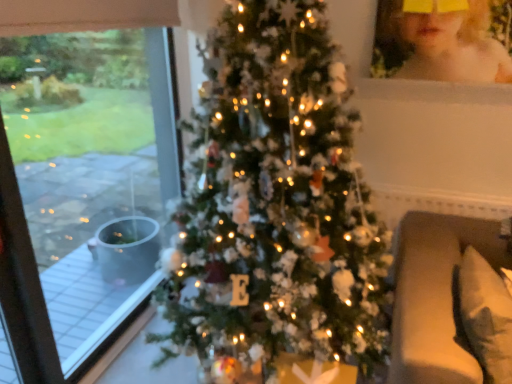
Question: Does transparent glass window at left have a lesser height compared to white soft pillow at lower right?

Choices:
 (A) no
 (B) yes

Answer: (A)

Question: Does transparent glass window at left turn towards white soft pillow at lower right?

Choices:
 (A) no
 (B) yes

Answer: (B)

Question: Is the position of transparent glass window at left more distant than that of white soft pillow at lower right?

Choices:
 (A) no
 (B) yes

Answer: (B)

Question: Is transparent glass window at left oriented away from white soft pillow at lower right?

Choices:
 (A) no
 (B) yes

Answer: (A)

Question: From a real-world perspective, is transparent glass window at left on white soft pillow at lower right?

Choices:
 (A) yes
 (B) no

Answer: (A)

Question: From the image's perspective, relative to transparent glass window at left, is white soft pillow at lower right above or below?

Choices:
 (A) below
 (B) above

Answer: (A)

Question: From their relative heights in the image, would you say white soft pillow at lower right is taller or shorter than transparent glass window at left?

Choices:
 (A) short
 (B) tall

Answer: (A)

Question: Does point (467, 307) appear closer or farther from the camera than point (7, 87)?

Choices:
 (A) closer
 (B) farther

Answer: (A)

Question: From a real-world perspective, is white soft pillow at lower right above or below transparent glass window at left?

Choices:
 (A) above
 (B) below

Answer: (B)

Question: From a real-world perspective, is blonde hair at upper right physically located above or below beige fabric couch at right?

Choices:
 (A) below
 (B) above

Answer: (B)

Question: Considering their positions, is blonde hair at upper right located in front of or behind beige fabric couch at right?

Choices:
 (A) behind
 (B) front

Answer: (A)

Question: From the image's perspective, is blonde hair at upper right positioned above or below beige fabric couch at right?

Choices:
 (A) above
 (B) below

Answer: (A)

Question: Is point (428, 16) closer or farther from the camera than point (466, 347)?

Choices:
 (A) closer
 (B) farther

Answer: (B)

Question: From the image's perspective, is beige fabric couch at right above or below transparent glass window at left?

Choices:
 (A) above
 (B) below

Answer: (B)

Question: Is beige fabric couch at right bigger or smaller than transparent glass window at left?

Choices:
 (A) big
 (B) small

Answer: (A)